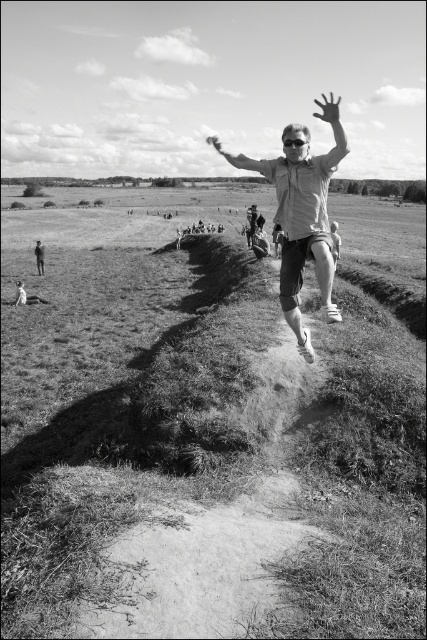
You are standing at the point labeled point (x=324, y=116) and want to walk towards the horizon where the trees are. Which direction should you walk to avoid the point labeled point (x=386, y=540)?

Since point (x=386, y=540) is in front of point (x=324, y=116), walking towards the horizon would require moving past point (x=386, y=540). To avoid it, you should walk sideways around it either to the left or right along the field.

You are a photographer analyzing the composition of this black and white photo. You notice the transparent plastic hand at upper center and the matte white shirt at center. Which object appears wider in the image?

The transparent plastic hand at upper center appears wider than the matte white shirt at center because its width surpasses the shirt.